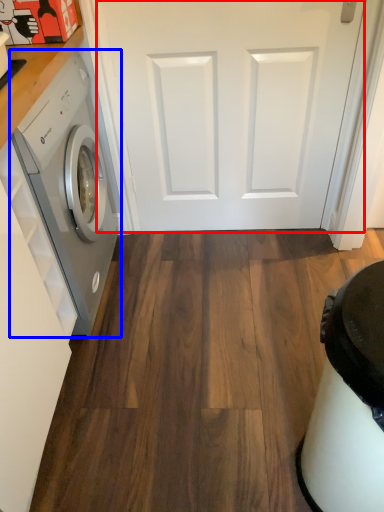
Question: Among these objects, which one is nearest to the camera, door (highlighted by a red box) or washing machine (highlighted by a blue box)?

Choices:
 (A) door
 (B) washing machine

Answer: (B)